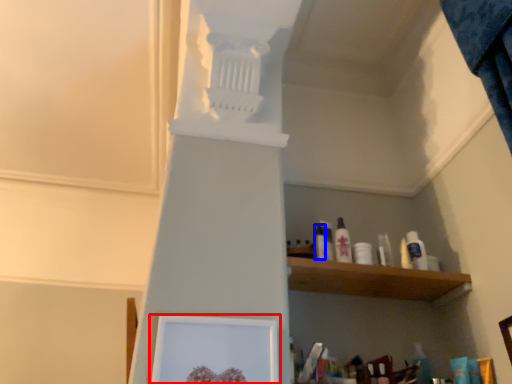
Question: Which object appears closest to the camera in this image, picture frame (highlighted by a red box) or toiletry (highlighted by a blue box)?

Choices:
 (A) picture frame
 (B) toiletry

Answer: (A)